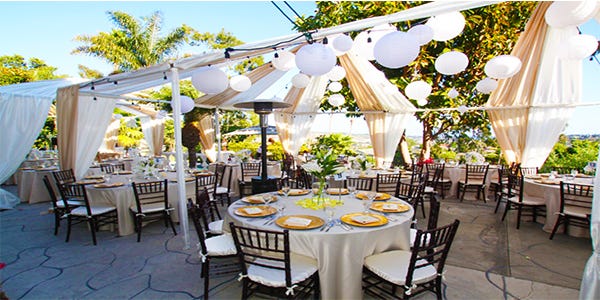
Where is `white napkins on plates`? Image resolution: width=600 pixels, height=300 pixels. white napkins on plates is located at coordinates (300, 223), (255, 211), (363, 217), (391, 206), (257, 199), (294, 191), (334, 189).